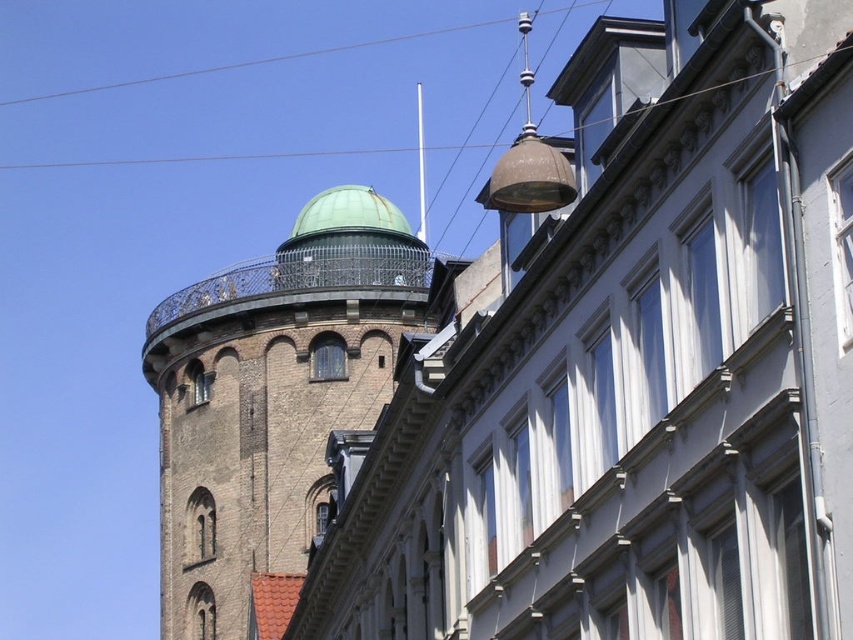
Question: Which object is positioned farthest from the clear wire at upper center?

Choices:
 (A) green copper dome at upper center
 (B) green copper dome at upper left

Answer: (B)

Question: Where is green copper dome at upper center located in relation to clear wire at upper center in the image?

Choices:
 (A) above
 (B) below

Answer: (B)

Question: Which point is closer to the camera taking this photo?

Choices:
 (A) (80, 88)
 (B) (303, 348)
 (C) (300, 230)

Answer: (B)

Question: Can you confirm if green copper dome at upper left is positioned below clear wire at upper center?

Choices:
 (A) no
 (B) yes

Answer: (B)

Question: Which object is farther from the camera taking this photo?

Choices:
 (A) green copper dome at upper center
 (B) green copper dome at upper left

Answer: (A)

Question: Does green copper dome at upper left appear under green copper dome at upper center?

Choices:
 (A) no
 (B) yes

Answer: (B)